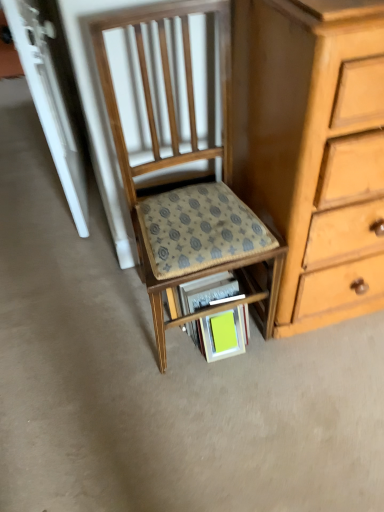
Question: Considering the relative sizes of wooden chair at center and bright yellow paper at lower center in the image provided, is wooden chair at center thinner than bright yellow paper at lower center?

Choices:
 (A) yes
 (B) no

Answer: (B)

Question: Considering the relative positions of wooden chair at center and bright yellow paper at lower center in the image provided, is wooden chair at center in front of bright yellow paper at lower center?

Choices:
 (A) no
 (B) yes

Answer: (B)

Question: From the image's perspective, is wooden chair at center located above bright yellow paper at lower center?

Choices:
 (A) no
 (B) yes

Answer: (B)

Question: Is the depth of wooden chair at center greater than that of bright yellow paper at lower center?

Choices:
 (A) yes
 (B) no

Answer: (B)

Question: Is wooden chair at center positioned with its back to bright yellow paper at lower center?

Choices:
 (A) no
 (B) yes

Answer: (A)

Question: Looking at their shapes, would you say wooden chair at center is wider or thinner than patterned fabric step stool at center?

Choices:
 (A) wide
 (B) thin

Answer: (A)

Question: From a real-world perspective, is wooden chair at center positioned above or below patterned fabric step stool at center?

Choices:
 (A) above
 (B) below

Answer: (A)

Question: In the image, is wooden chair at center positioned in front of or behind patterned fabric step stool at center?

Choices:
 (A) front
 (B) behind

Answer: (A)

Question: Based on their positions, is wooden chair at center located to the left or right of patterned fabric step stool at center?

Choices:
 (A) left
 (B) right

Answer: (A)

Question: In the image, is wooden chair at center positioned in front of or behind bright yellow paper at lower center?

Choices:
 (A) front
 (B) behind

Answer: (A)

Question: Is wooden chair at center taller or shorter than bright yellow paper at lower center?

Choices:
 (A) short
 (B) tall

Answer: (B)

Question: In terms of width, does wooden chair at center look wider or thinner when compared to bright yellow paper at lower center?

Choices:
 (A) thin
 (B) wide

Answer: (B)

Question: Considering the positions of wooden chair at center and bright yellow paper at lower center in the image, is wooden chair at center bigger or smaller than bright yellow paper at lower center?

Choices:
 (A) small
 (B) big

Answer: (B)

Question: In terms of width, does bright yellow paper at lower center look wider or thinner when compared to patterned fabric step stool at center?

Choices:
 (A) thin
 (B) wide

Answer: (A)

Question: Considering the positions of bright yellow paper at lower center and patterned fabric step stool at center in the image, is bright yellow paper at lower center taller or shorter than patterned fabric step stool at center?

Choices:
 (A) tall
 (B) short

Answer: (B)